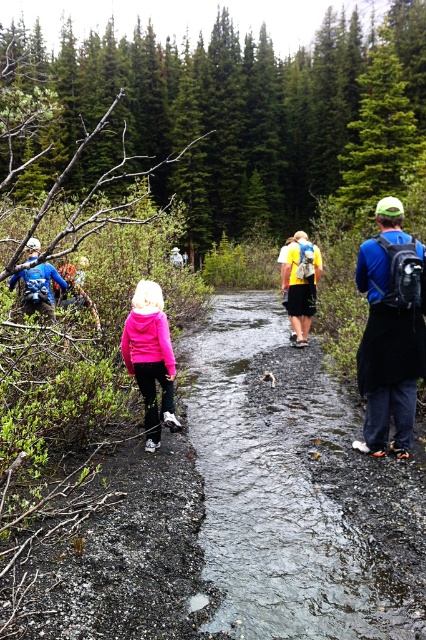
Question: Can you confirm if blue matte backpack at center-right is bigger than pink fleece jacket at center?

Choices:
 (A) no
 (B) yes

Answer: (B)

Question: Can you confirm if wet gravel stream at center is positioned above yellow fabric backpack at center?

Choices:
 (A) no
 (B) yes

Answer: (A)

Question: Observing the image, what is the correct spatial positioning of wet gravel stream at center in reference to pink fleece jacket at center?

Choices:
 (A) below
 (B) above

Answer: (A)

Question: Among these objects, which one is farthest from the camera?

Choices:
 (A) wet gravel stream at center
 (B) matte blue jacket at left

Answer: (B)

Question: Which point is farther from the camera taking this photo?

Choices:
 (A) (302, 150)
 (B) (409, 346)
 (C) (157, 428)
 (D) (317, 250)

Answer: (A)

Question: Which point appears farthest from the camera in this image?

Choices:
 (A) (314, 308)
 (B) (157, 150)
 (C) (28, 292)
 (D) (143, 364)

Answer: (B)